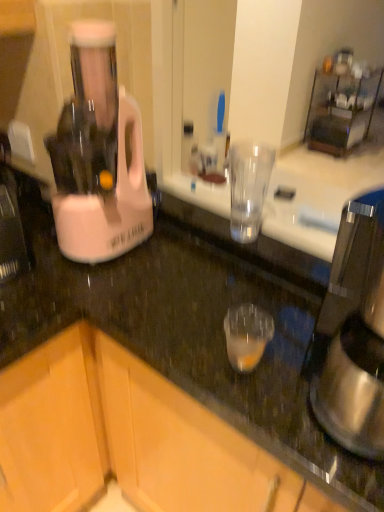
Question: Does wooden cabinet at lower left, acting as the second cabinetry starting from the left, appear on the left side of satin silver coffee maker at right?

Choices:
 (A) yes
 (B) no

Answer: (A)

Question: Is wooden cabinet at lower left, acting as the second cabinetry starting from the left, oriented away from satin silver coffee maker at right?

Choices:
 (A) no
 (B) yes

Answer: (A)

Question: From a real-world perspective, is wooden cabinet at lower left, acting as the second cabinetry starting from the left, physically above satin silver coffee maker at right?

Choices:
 (A) yes
 (B) no

Answer: (B)

Question: Can you confirm if wooden cabinet at lower left, which is counted as the 1th cabinetry, starting from the right, is shorter than satin silver coffee maker at right?

Choices:
 (A) no
 (B) yes

Answer: (A)

Question: Is wooden cabinet at lower left, acting as the second cabinetry starting from the left, wider than satin silver coffee maker at right?

Choices:
 (A) yes
 (B) no

Answer: (A)

Question: Is wooden cabinet at lower left, which ranks as the first cabinetry in left-to-right order, wider or thinner than pink plastic blender at left?

Choices:
 (A) thin
 (B) wide

Answer: (B)

Question: In the image, is wooden cabinet at lower left, which ranks as the first cabinetry in left-to-right order, positioned in front of or behind pink plastic blender at left?

Choices:
 (A) behind
 (B) front

Answer: (A)

Question: Is wooden cabinet at lower left, which ranks as the 2th cabinetry in right-to-left order, to the left or to the right of pink plastic blender at left in the image?

Choices:
 (A) left
 (B) right

Answer: (A)

Question: From the image's perspective, is wooden cabinet at lower left, which ranks as the first cabinetry in left-to-right order, located above or below pink plastic blender at left?

Choices:
 (A) above
 (B) below

Answer: (B)

Question: Based on their positions, is pink plastic blender at left located to the left or right of wooden cabinet at lower left, which is counted as the 1th cabinetry, starting from the right?

Choices:
 (A) right
 (B) left

Answer: (B)

Question: In the image, is pink plastic blender at left positioned in front of or behind wooden cabinet at lower left, which is counted as the 1th cabinetry, starting from the right?

Choices:
 (A) behind
 (B) front

Answer: (A)

Question: Is pink plastic blender at left wider or thinner than wooden cabinet at lower left, acting as the second cabinetry starting from the left?

Choices:
 (A) thin
 (B) wide

Answer: (A)

Question: From a real-world perspective, is pink plastic blender at left positioned above or below wooden cabinet at lower left, acting as the second cabinetry starting from the left?

Choices:
 (A) above
 (B) below

Answer: (A)

Question: Looking at their shapes, would you say satin silver coffee maker at right is wider or thinner than pink plastic blender at left?

Choices:
 (A) thin
 (B) wide

Answer: (B)

Question: Considering the positions of satin silver coffee maker at right and pink plastic blender at left in the image, is satin silver coffee maker at right bigger or smaller than pink plastic blender at left?

Choices:
 (A) small
 (B) big

Answer: (A)